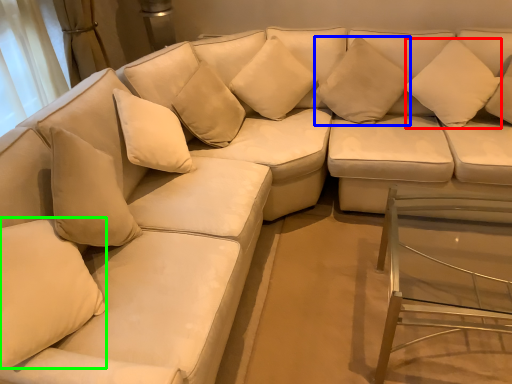
Question: Which object is positioned closest to pillow (highlighted by a red box)? Select from pillow (highlighted by a blue box) and pillow (highlighted by a green box).

Choices:
 (A) pillow
 (B) pillow

Answer: (A)